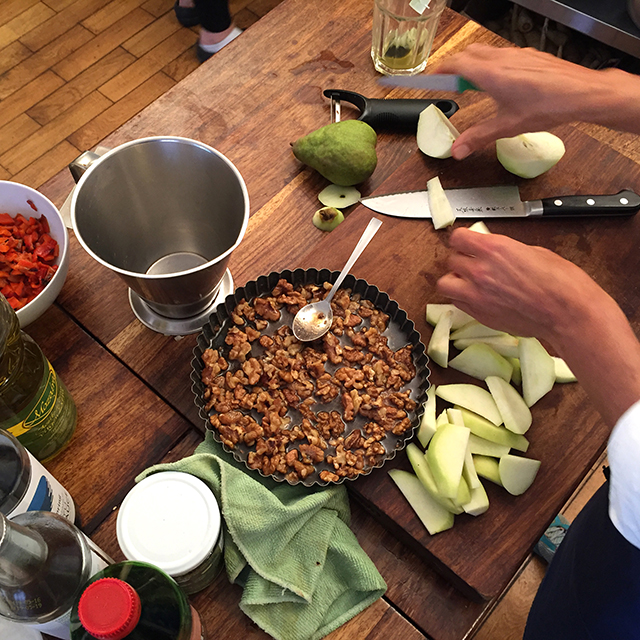
The width and height of the screenshot is (640, 640). I want to click on bowls, so click(x=401, y=324), click(x=196, y=276), click(x=58, y=228).